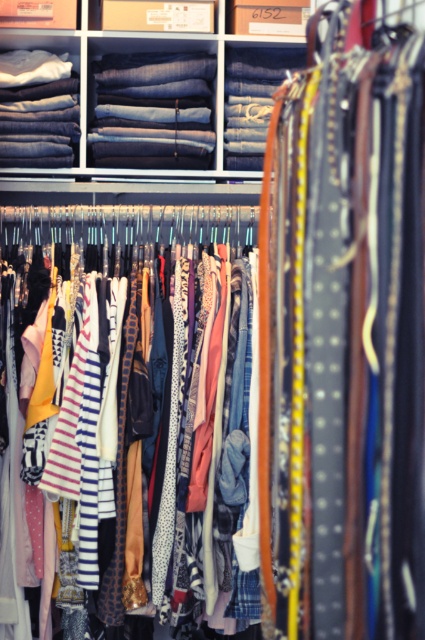
Who is more distant from viewer, (87, 529) or (51, 161)?

Positioned behind is point (51, 161).

Is printed fabric dress at center below denim fabric jeans at upper center?

Yes, printed fabric dress at center is below denim fabric jeans at upper center.

At what (x,y) coordinates should I click in order to perform the action: click on printed fabric dress at center. Please return your answer as a coordinate pair (x, y). The width and height of the screenshot is (425, 640). Looking at the image, I should click on (110, 436).

Does denim jeans at upper center appear on the left side of denim jeans at upper left?

In fact, denim jeans at upper center is to the right of denim jeans at upper left.

At what (x,y) coordinates should I click in order to perform the action: click on denim jeans at upper center. Please return your answer as a coordinate pair (x, y). The image size is (425, 640). Looking at the image, I should click on (152, 108).

Find the location of a particular element. denim jeans at upper center is located at coordinates (152, 108).

Is printed fabric dress at center shorter than denim jeans at upper left?

No, printed fabric dress at center is not shorter than denim jeans at upper left.

Does printed fabric dress at center appear on the right side of denim jeans at upper left?

Indeed, printed fabric dress at center is positioned on the right side of denim jeans at upper left.

Does point (102, 582) come farther from viewer compared to point (2, 52)?

No, (102, 582) is in front of (2, 52).

I want to click on printed fabric dress at center, so click(110, 436).